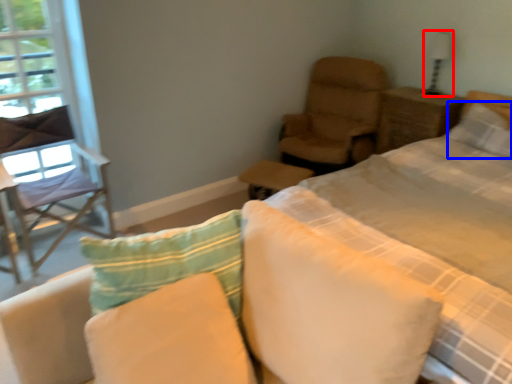
Question: Which of the following is the farthest to the observer, table lamp (highlighted by a red box) or pillow (highlighted by a blue box)?

Choices:
 (A) table lamp
 (B) pillow

Answer: (A)